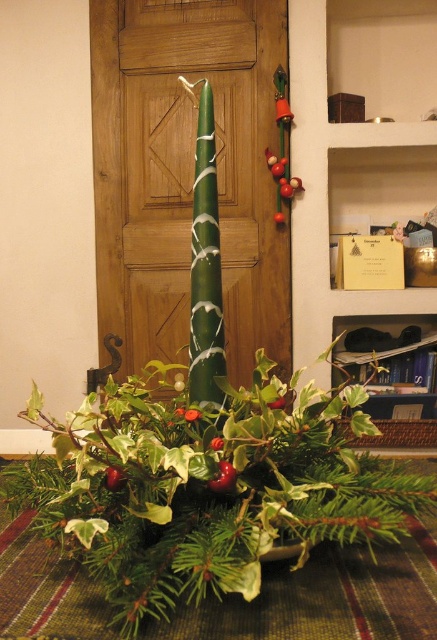
Does matte brown wood bookshelf at upper center have a lesser width compared to metallic green ornament at upper center?

In fact, matte brown wood bookshelf at upper center might be wider than metallic green ornament at upper center.

Which of these two, matte brown wood bookshelf at upper center or metallic green ornament at upper center, stands shorter?

metallic green ornament at upper center is shorter.

Is point (295, 304) in front of point (291, 184)?

No, it is not.

Where is `matte brown wood bookshelf at upper center`? matte brown wood bookshelf at upper center is located at coordinates (357, 147).

Can you confirm if green matte candle at center is positioned above matte brown wood bookshelf at upper center?

No.

Is green matte candle at center thinner than matte brown wood bookshelf at upper center?

Correct, green matte candle at center's width is less than matte brown wood bookshelf at upper center's.

Is point (142, 518) less distant than point (292, 148)?

Yes.

This screenshot has height=640, width=437. I want to click on green matte candle at center, so click(x=207, y=486).

I want to click on green matte candle at center, so click(x=207, y=486).

Does point (152, 401) come farther from viewer compared to point (290, 170)?

Yes.

From the picture: Measure the distance between green matte candle at center and camera.

15.74 inches

Locate an element on the screen. This screenshot has width=437, height=640. green matte candle at center is located at coordinates (207, 486).